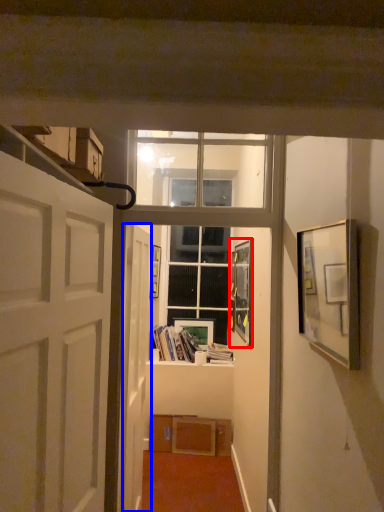
Question: Which object appears farthest to the camera in this image, picture frame (highlighted by a red box) or door (highlighted by a blue box)?

Choices:
 (A) picture frame
 (B) door

Answer: (A)